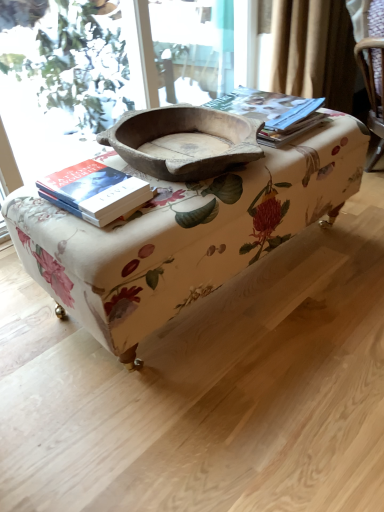
Question: Considering the relative sizes of hardcover book at left and floral fabric ottoman at center in the image provided, is hardcover book at left taller than floral fabric ottoman at center?

Choices:
 (A) yes
 (B) no

Answer: (B)

Question: Is hardcover book at left smaller than floral fabric ottoman at center?

Choices:
 (A) yes
 (B) no

Answer: (A)

Question: Does hardcover book at left have a larger size compared to floral fabric ottoman at center?

Choices:
 (A) no
 (B) yes

Answer: (A)

Question: Is hardcover book at left further to camera compared to floral fabric ottoman at center?

Choices:
 (A) no
 (B) yes

Answer: (B)

Question: Could you tell me if hardcover book at left is facing floral fabric ottoman at center?

Choices:
 (A) no
 (B) yes

Answer: (A)

Question: Is hardcover book at left surrounding floral fabric ottoman at center?

Choices:
 (A) yes
 (B) no

Answer: (B)

Question: From a real-world perspective, is matte paper at upper right located higher than natural wood bowl at center?

Choices:
 (A) no
 (B) yes

Answer: (A)

Question: Is there a large distance between matte paper at upper right and natural wood bowl at center?

Choices:
 (A) no
 (B) yes

Answer: (A)

Question: From the image's perspective, is matte paper at upper right on top of natural wood bowl at center?

Choices:
 (A) no
 (B) yes

Answer: (B)

Question: Is matte paper at upper right positioned beyond the bounds of natural wood bowl at center?

Choices:
 (A) no
 (B) yes

Answer: (B)

Question: From a real-world perspective, is matte paper at upper right positioned under natural wood bowl at center based on gravity?

Choices:
 (A) yes
 (B) no

Answer: (A)

Question: Is matte paper at upper right positioned with its back to natural wood bowl at center?

Choices:
 (A) yes
 (B) no

Answer: (B)

Question: Is natural wood bowl at center at the back of hardcover book at left?

Choices:
 (A) yes
 (B) no

Answer: (B)